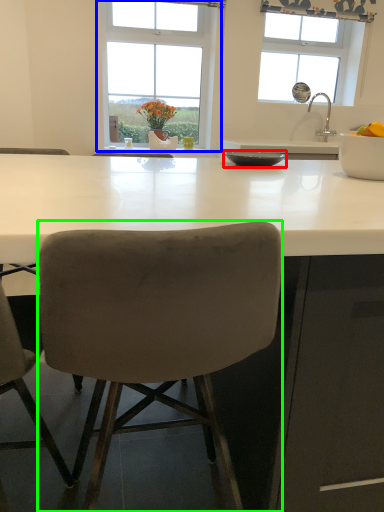
Question: Estimate the real-world distances between objects in this image. Which object is farther from bowl (highlighted by a red box), window (highlighted by a blue box) or chair (highlighted by a green box)?

Choices:
 (A) window
 (B) chair

Answer: (A)